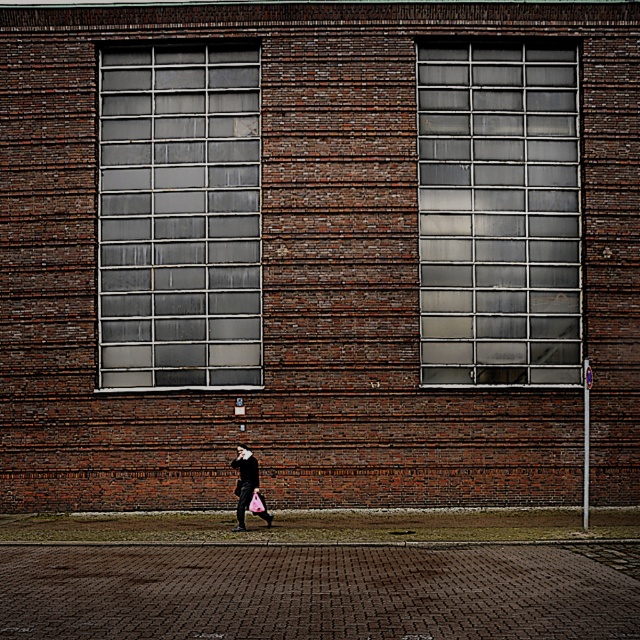
Is brick pavement at lower center positioned in front of black matte coat at center?

Yes.

Between brick pavement at lower center and black matte coat at center, which one has less height?

brick pavement at lower center is shorter.

Identify the location of brick pavement at lower center. This screenshot has height=640, width=640. (312, 593).

I want to click on brick pavement at lower center, so click(312, 593).